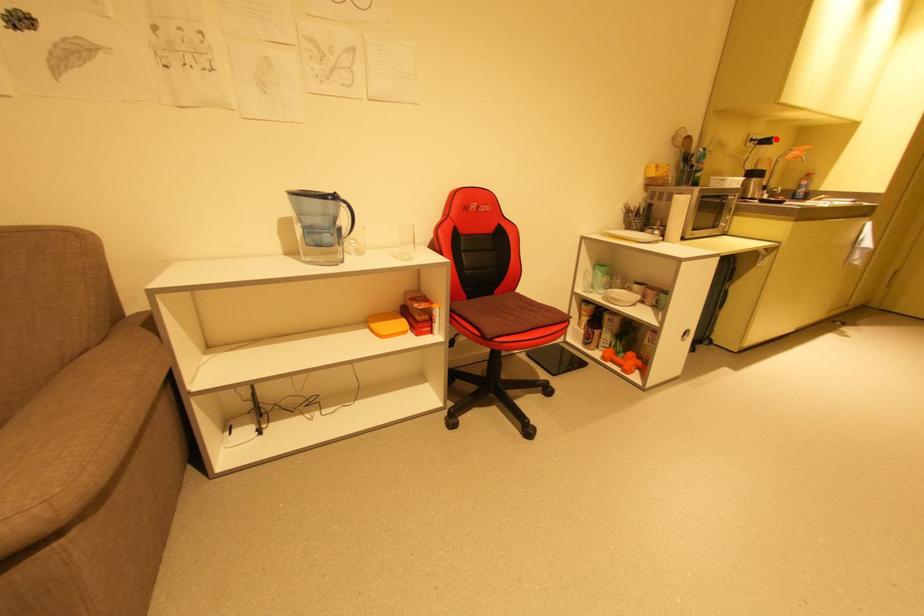
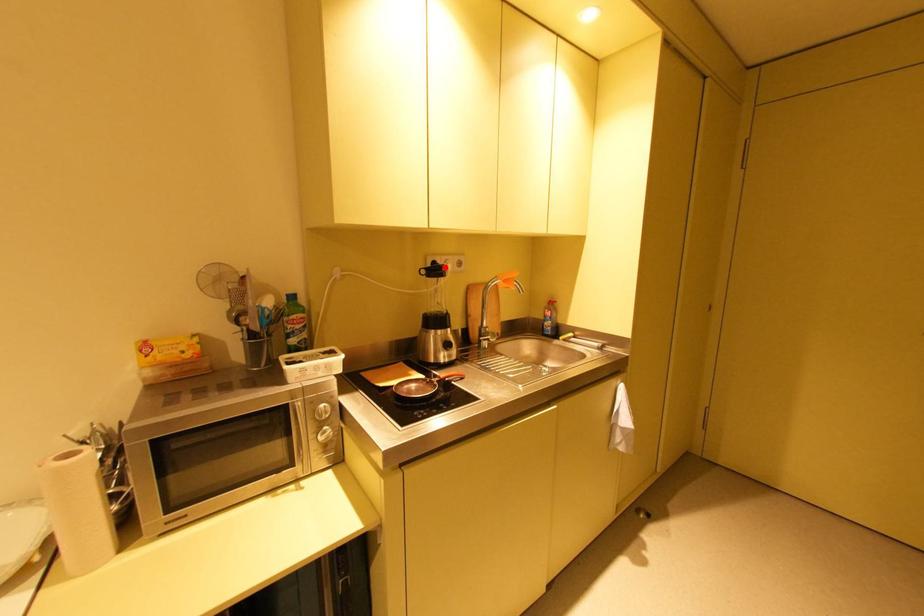
I am providing you with two images of the same scene from different viewpoints. A red point is marked on the first image and another point is marked on the second image. Is the red point in image1 aligned with the point shown in image2?

Yes